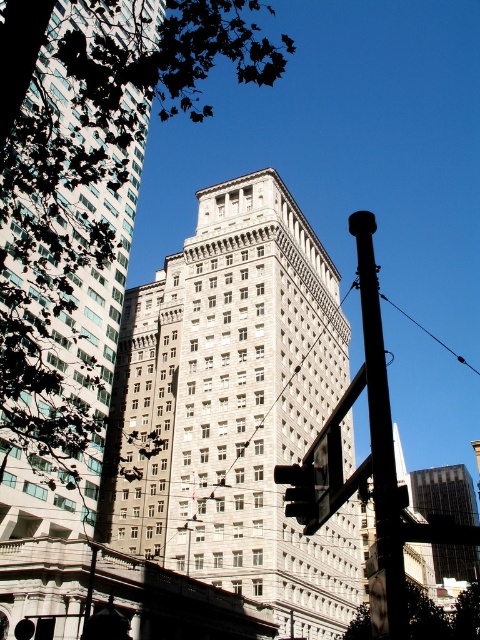
Looking at this image, you are standing at the point marked by the coordinates point (380, 428). Looking towards the two buildings in the scene, which one is closer to you?

The metallic pole at center is located at point (380, 428). Since the pole is in the foreground, it is closer to you than both buildings. However, between the two buildings, the modern glass building on the left appears closer than the older stone building on the right due to its position in the scene.

You are standing at the base of the dark utility pole with a traffic signal in the cityscape. You see two points marked in the image. The first point is at coordinates point (148, 0), and the second point is at coordinates point (471, 582). Which of these points is closer to you?

Point (148, 0) is closer to you because it is in front of point (471, 582).